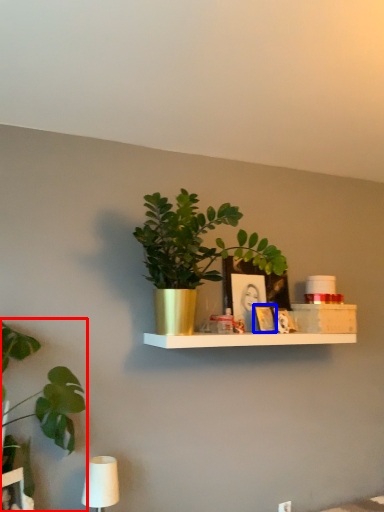
Question: Which object appears closest to the camera in this image, houseplant (highlighted by a red box) or picture frame (highlighted by a blue box)?

Choices:
 (A) houseplant
 (B) picture frame

Answer: (A)